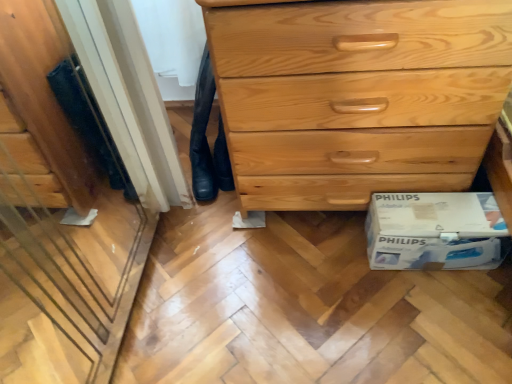
Locate an element on the screen. vacant space that's between light wood chest of drawers at center and white cardboard box at lower right is located at coordinates (318, 250).